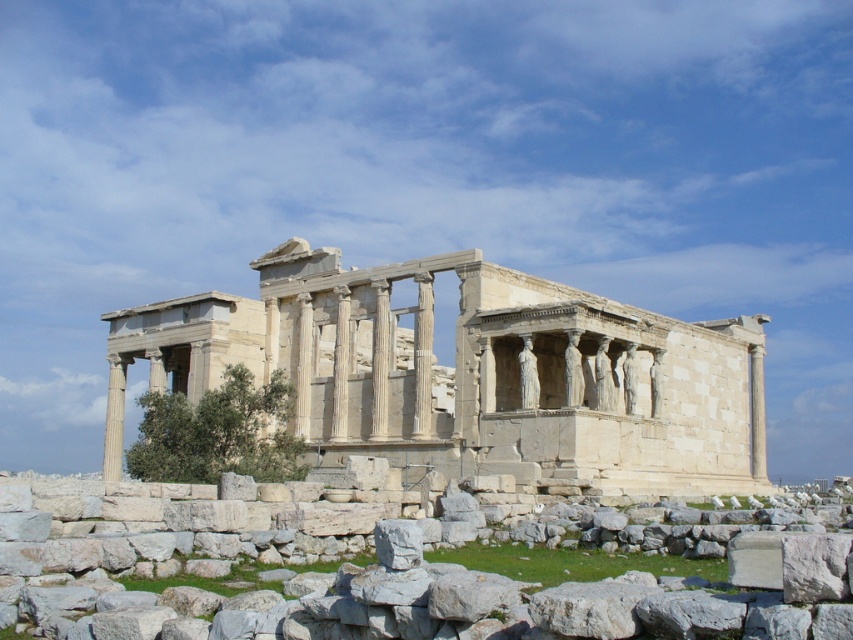
Question: Among these objects, which one is farthest from the camera?

Choices:
 (A) white stone ruins at center
 (B) white stone at center

Answer: (A)

Question: Considering the relative positions of white stone ruins at center and white stone at center in the image provided, where is white stone ruins at center located with respect to white stone at center?

Choices:
 (A) above
 (B) below

Answer: (A)

Question: Is white stone ruins at center thinner than white stone at center?

Choices:
 (A) no
 (B) yes

Answer: (A)

Question: Which point appears closest to the camera in this image?

Choices:
 (A) (25, 516)
 (B) (720, 364)

Answer: (A)

Question: Does white stone ruins at center appear under white stone at center?

Choices:
 (A) no
 (B) yes

Answer: (A)

Question: Which point is closer to the camera?

Choices:
 (A) white stone at center
 (B) white stone ruins at center

Answer: (A)